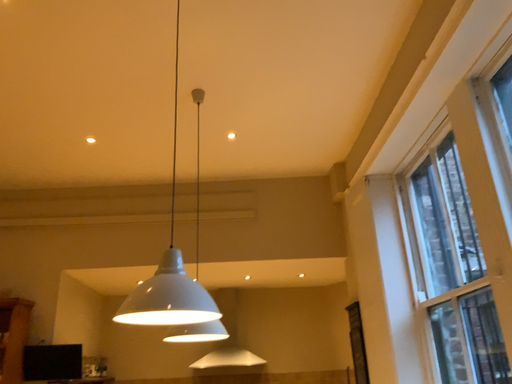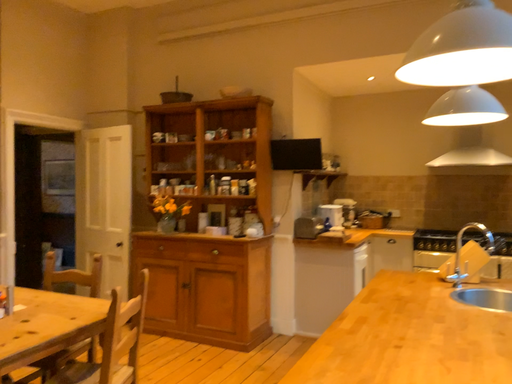
Question: How did the camera likely rotate when shooting the video?

Choices:
 (A) rotated right
 (B) rotated left

Answer: (B)